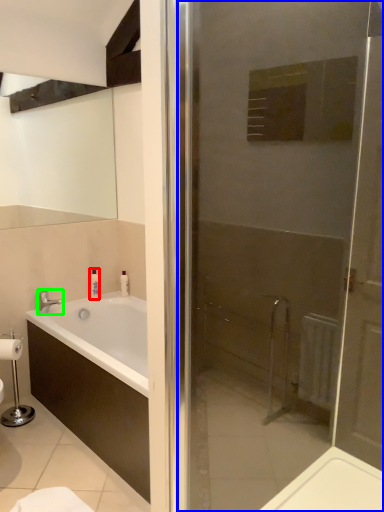
Question: Which is farther away from toiletry (highlighted by a red box)? door (highlighted by a blue box) or tap (highlighted by a green box)?

Choices:
 (A) door
 (B) tap

Answer: (A)